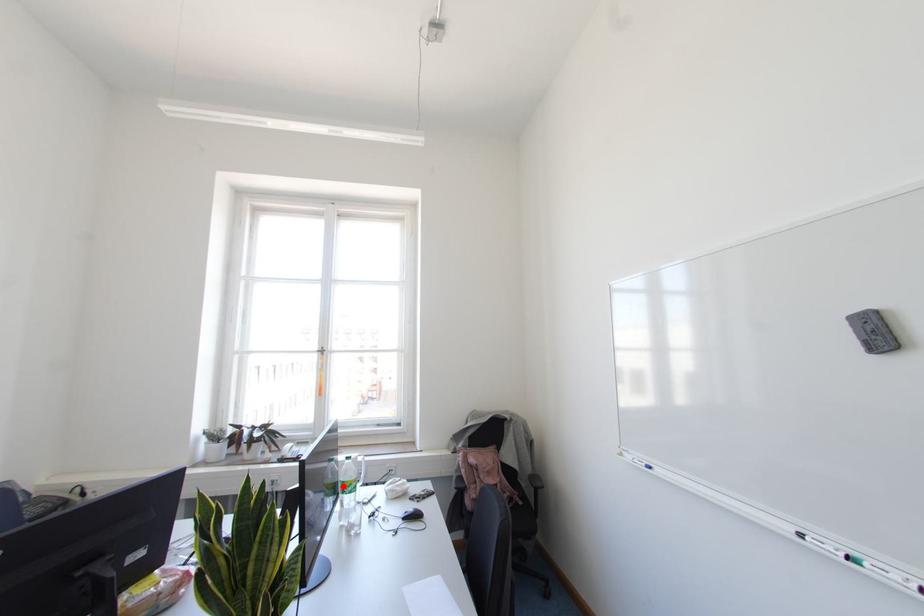
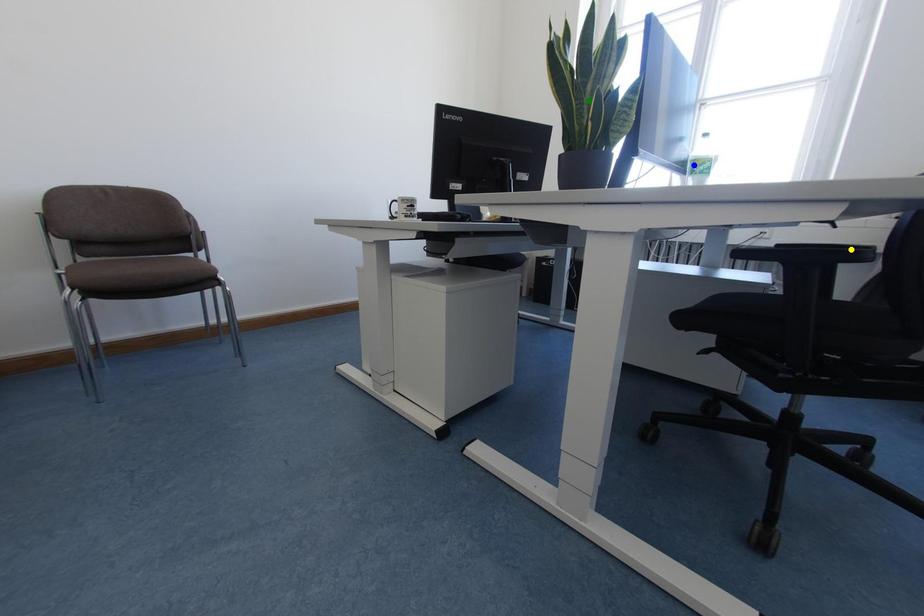
Question: I am providing you with two images of the same scene from different viewpoints. A red point is marked on the first image. You are given multiple points on the second image. Can you choose the point in image 2 that corresponds to the point in image 1?

Choices:
 (A) yellow point
 (B) green point
 (C) blue point

Answer: (C)